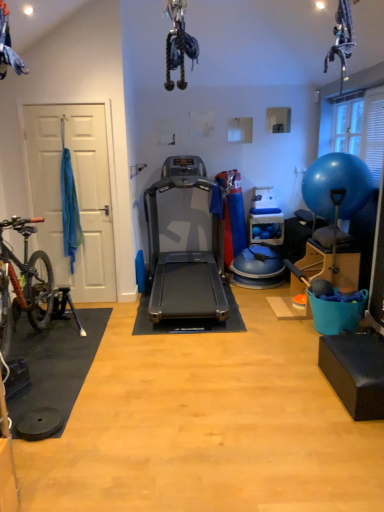
Question: Is silver metallic treadmill at center thinner than blue rubber ball at right?

Choices:
 (A) no
 (B) yes

Answer: (A)

Question: From the image's perspective, is silver metallic treadmill at center over blue rubber ball at right?

Choices:
 (A) no
 (B) yes

Answer: (A)

Question: Is the position of silver metallic treadmill at center more distant than that of blue rubber ball at right?

Choices:
 (A) no
 (B) yes

Answer: (A)

Question: Can you confirm if silver metallic treadmill at center is smaller than blue rubber ball at right?

Choices:
 (A) no
 (B) yes

Answer: (A)

Question: Does silver metallic treadmill at center turn towards blue rubber ball at right?

Choices:
 (A) yes
 (B) no

Answer: (B)

Question: From the image's perspective, is transparent plastic window screen at upper right positioned above or below blue rubber ball at right?

Choices:
 (A) above
 (B) below

Answer: (A)

Question: Would you say transparent plastic window screen at upper right is to the left or to the right of blue rubber ball at right in the picture?

Choices:
 (A) left
 (B) right

Answer: (B)

Question: Looking at their shapes, would you say transparent plastic window screen at upper right is wider or thinner than blue rubber ball at right?

Choices:
 (A) wide
 (B) thin

Answer: (B)

Question: Is transparent plastic window screen at upper right spatially inside blue rubber ball at right, or outside of it?

Choices:
 (A) outside
 (B) inside

Answer: (A)

Question: Looking at their shapes, would you say blue rubber ball at right is wider or thinner than transparent plastic window screen at upper right?

Choices:
 (A) thin
 (B) wide

Answer: (B)

Question: Is blue rubber ball at right in front of or behind transparent plastic window screen at upper right in the image?

Choices:
 (A) front
 (B) behind

Answer: (A)

Question: Looking at the image, does blue rubber ball at right seem bigger or smaller compared to transparent plastic window screen at upper right?

Choices:
 (A) small
 (B) big

Answer: (B)

Question: From the image's perspective, relative to transparent plastic window screen at upper right, is blue rubber ball at right above or below?

Choices:
 (A) below
 (B) above

Answer: (A)

Question: Is silver metallic treadmill at center taller or shorter than transparent plastic window screen at upper right?

Choices:
 (A) tall
 (B) short

Answer: (A)

Question: Looking at the image, does silver metallic treadmill at center seem bigger or smaller compared to transparent plastic window screen at upper right?

Choices:
 (A) small
 (B) big

Answer: (B)